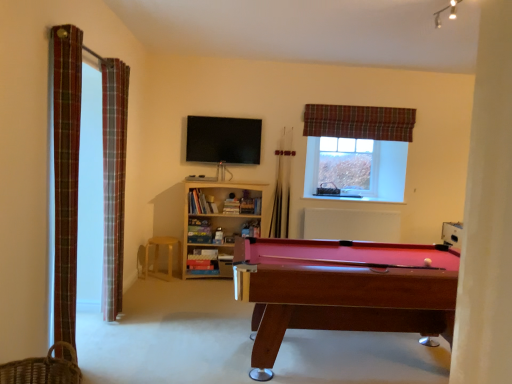
Image resolution: width=512 pixels, height=384 pixels. In order to click on unoccupied space behind plaid fabric curtain at left, which ranks as the 1th curtain in front-to-back order in this screenshot , I will do `click(91, 348)`.